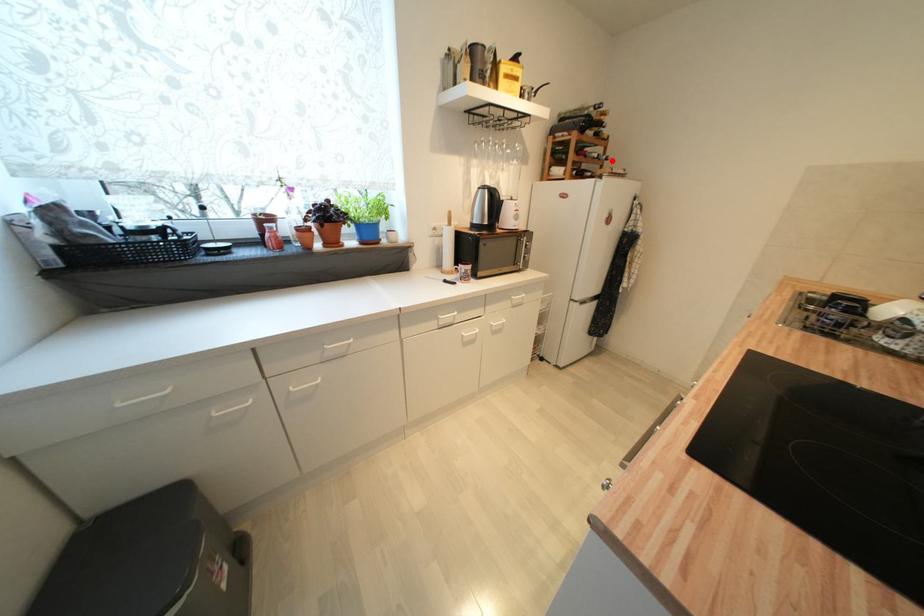
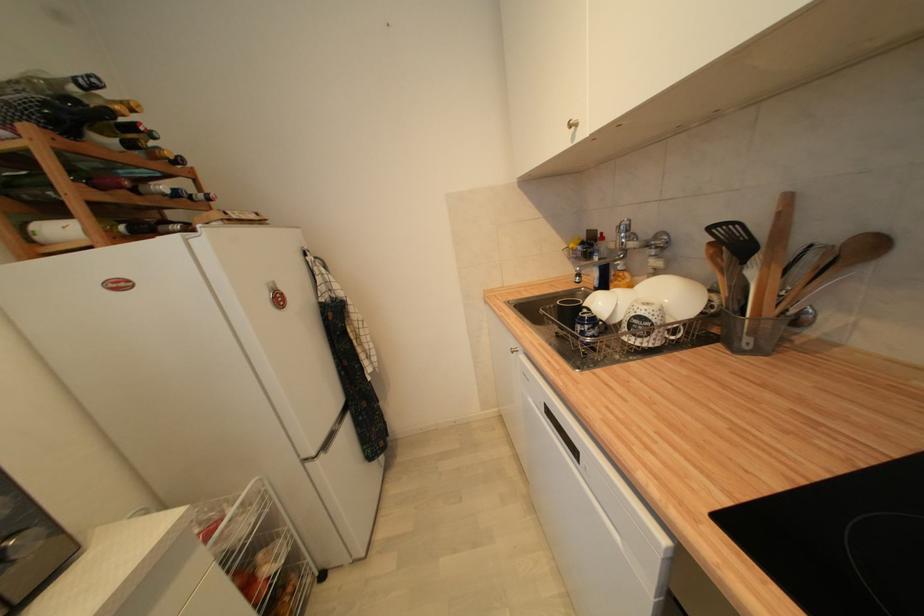
In the second image, find the point that corresponds to the highlighted location in the first image.

(213, 200)